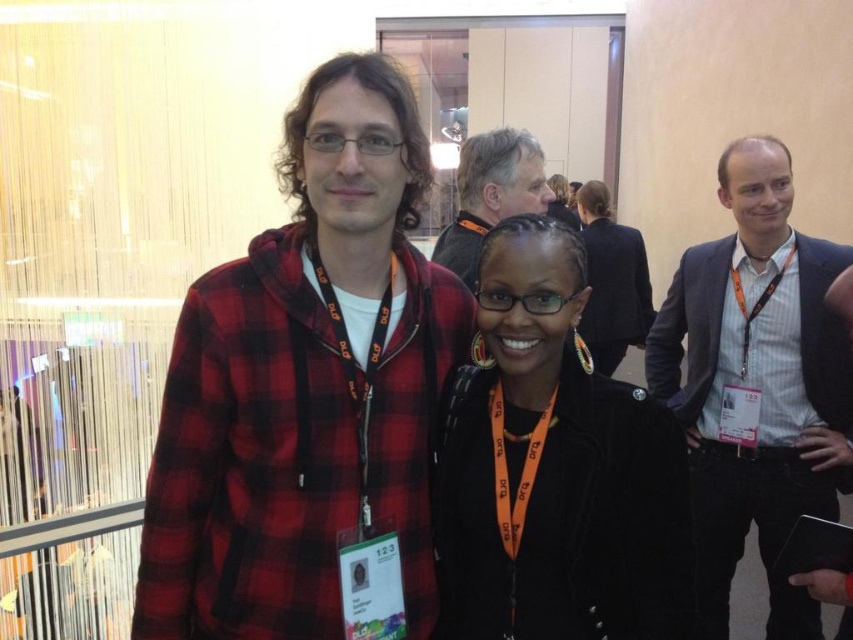
Between red plaid hoodie at center and light brown hair at upper center, which one has less height?

With less height is light brown hair at upper center.

Between red plaid hoodie at center and light brown hair at upper center, which one appears on the right side from the viewer's perspective?

light brown hair at upper center

Locate an element on the screen. The height and width of the screenshot is (640, 853). red plaid hoodie at center is located at coordinates (306, 385).

The height and width of the screenshot is (640, 853). Describe the element at coordinates (554, 468) in the screenshot. I see `black matte jacket at center` at that location.

Image resolution: width=853 pixels, height=640 pixels. What do you see at coordinates (554, 468) in the screenshot?
I see `black matte jacket at center` at bounding box center [554, 468].

Locate an element on the screen. black matte jacket at center is located at coordinates (554, 468).

Image resolution: width=853 pixels, height=640 pixels. Find the location of `black matte jacket at center`. black matte jacket at center is located at coordinates tap(554, 468).